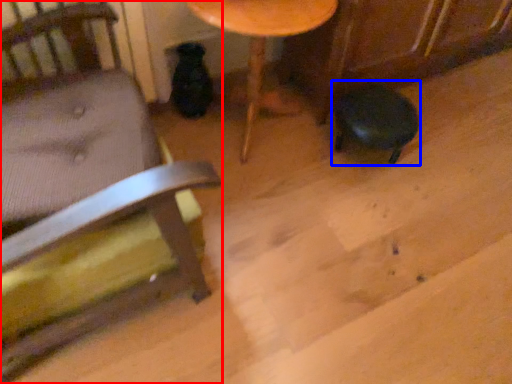
Question: Which of the following is the farthest to the observer, chair (highlighted by a red box) or bar stool (highlighted by a blue box)?

Choices:
 (A) chair
 (B) bar stool

Answer: (B)